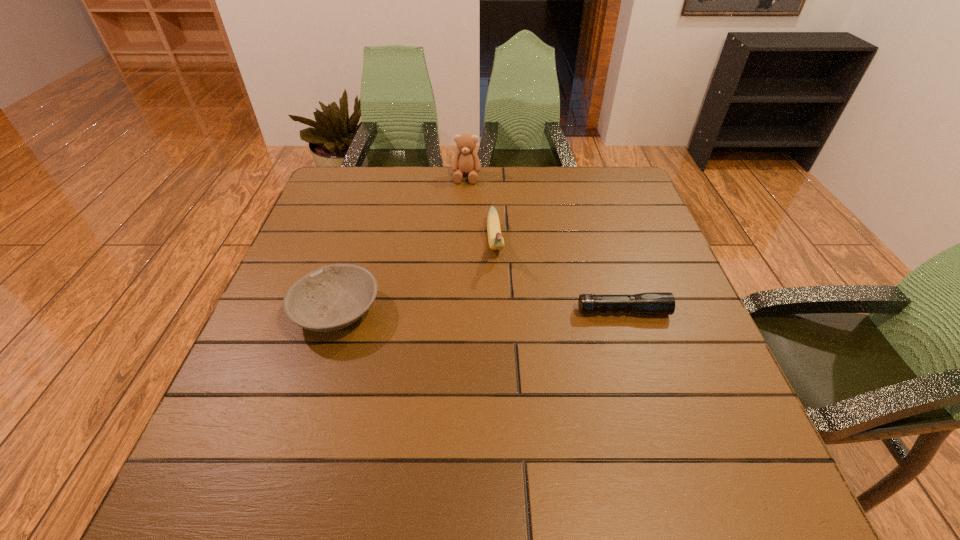
Find the location of a particular element. The width and height of the screenshot is (960, 540). vacant area between the third object from right to left and the third tallest object is located at coordinates tap(401, 244).

I want to click on empty space between the banana and the flashlight, so click(x=559, y=278).

Locate an element on the screen. free space between the teddy bear and the shortest object is located at coordinates (544, 244).

I want to click on vacant point located between the tallest object and the flashlight, so click(x=544, y=244).

Locate an element on the screen. This screenshot has width=960, height=540. object that is the third closest one to the bowl is located at coordinates (655, 303).

This screenshot has height=540, width=960. I want to click on object that is the nearest to the third shortest object, so [x=466, y=161].

This screenshot has height=540, width=960. I want to click on vacant area that satisfies the following two spatial constraints: 1. on the front side of the third nearest object; 2. at the lens end of the rightmost object, so click(x=497, y=311).

The height and width of the screenshot is (540, 960). Find the location of `free space that satisfies the following two spatial constraints: 1. on the front side of the rightmost object; 2. at the lens end of the tallest object`. free space that satisfies the following two spatial constraints: 1. on the front side of the rightmost object; 2. at the lens end of the tallest object is located at coordinates (461, 311).